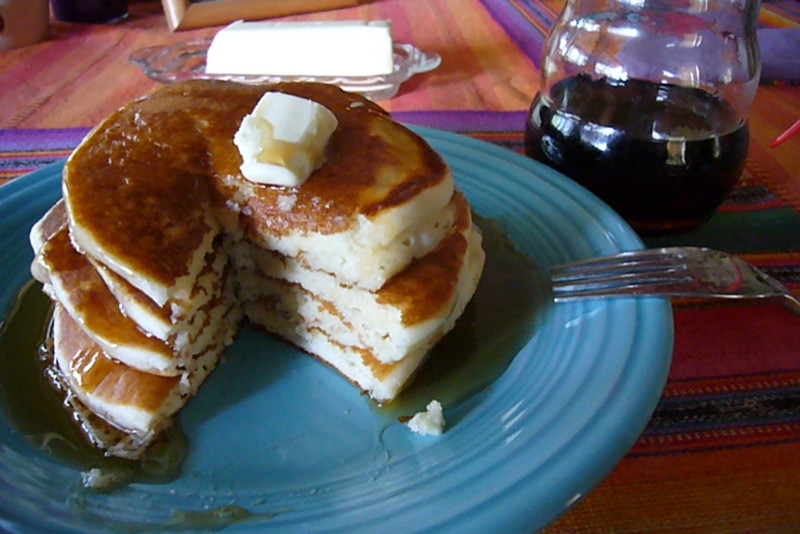
Identify the location of glass. This screenshot has width=800, height=534. (668, 184).